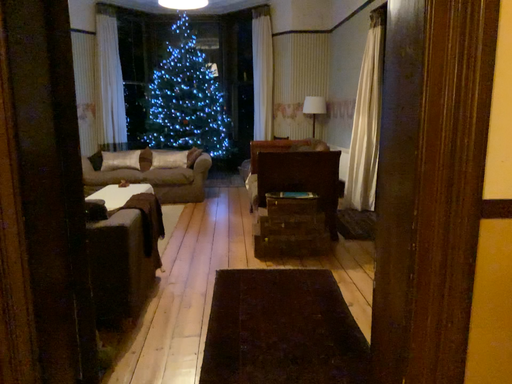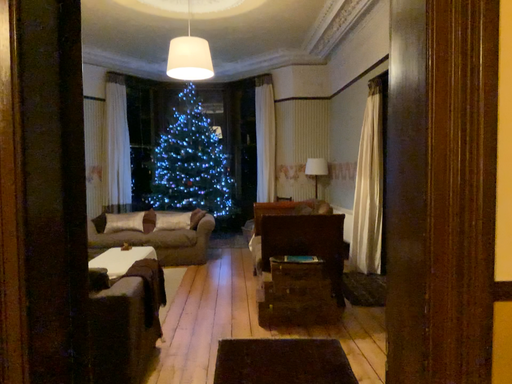
Question: How did the camera likely rotate when shooting the video?

Choices:
 (A) rotated upward
 (B) rotated downward

Answer: (A)